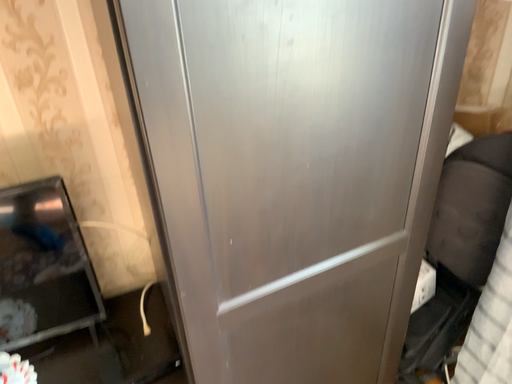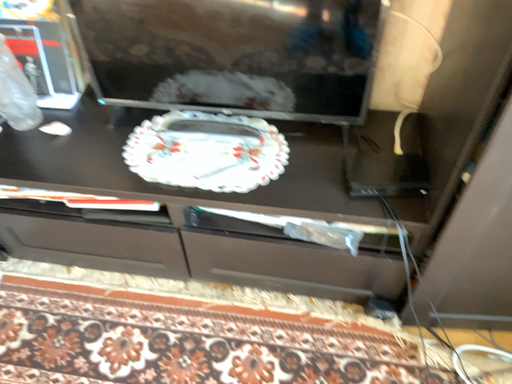
Question: Which way did the camera rotate in the video?

Choices:
 (A) rotated downward
 (B) rotated upward

Answer: (A)